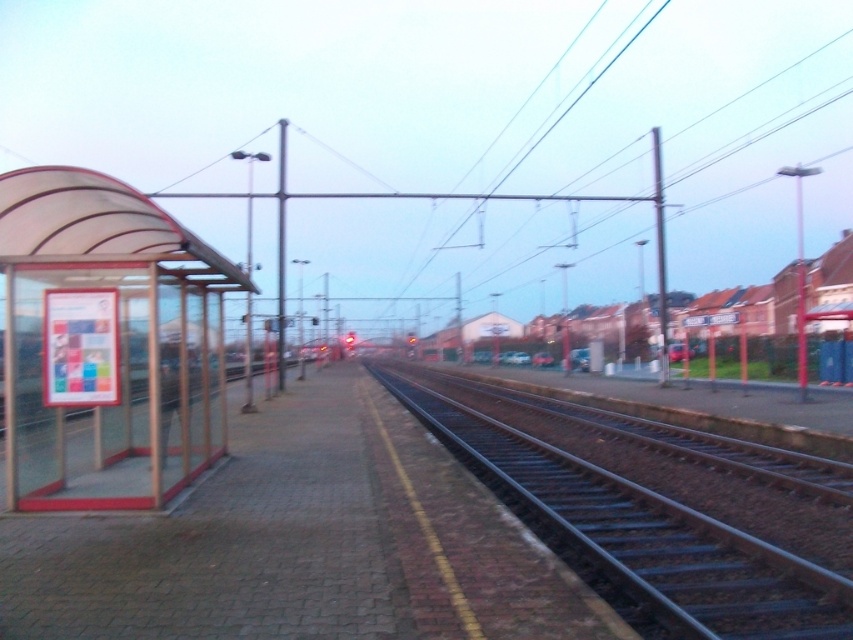
From the picture: You are standing at the railway station platform and want to catch a bus. The bus stop is located at point (107,342). Which direction should you walk to reach the transparent plastic bus stop at left from your current position?

The transparent plastic bus stop at left is located at point (107,342). Since it is at the left side of the platform, you should walk towards the left direction to reach it.

You are a visually impaired person using a white cane. You are standing on the platform and want to locate the transparent plastic bus stop at left and the black steel train track at center. According to the scene, which object is positioned higher relative to the other?

The transparent plastic bus stop at left is located above the black steel train track at center, so it is positioned higher.